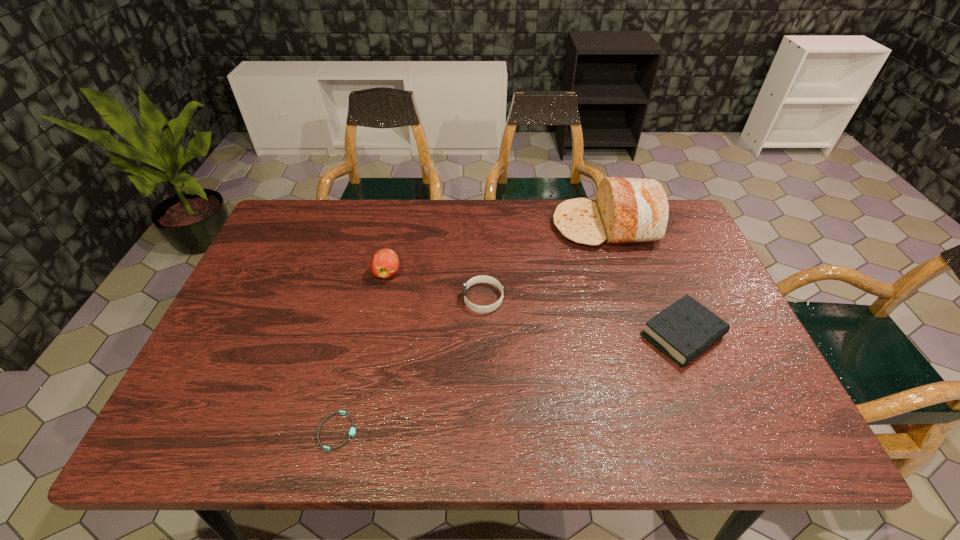
Image resolution: width=960 pixels, height=540 pixels. I want to click on free spot that satisfies the following two spatial constraints: 1. at the sliced end of the tallest object; 2. on the left side of the Bible, so click(x=640, y=336).